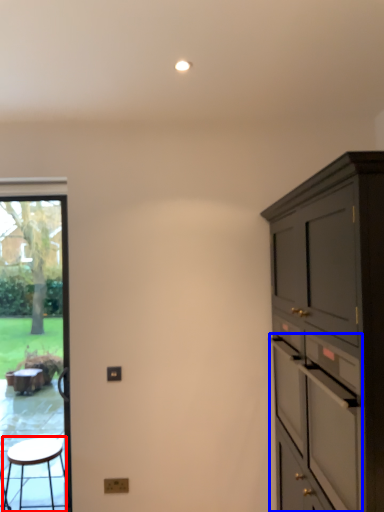
Question: Which object appears farthest to the camera in this image, stool (highlighted by a red box) or drawer (highlighted by a blue box)?

Choices:
 (A) stool
 (B) drawer

Answer: (A)